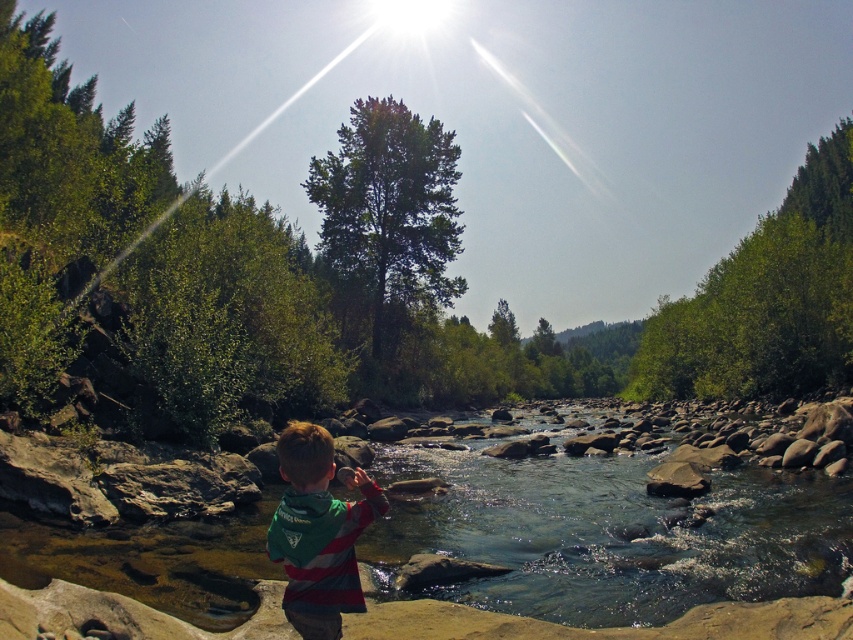
You are a parent who wants to ensure the safety of your child. The striped jersey boy at center is standing on the riverbank. Can you confirm if the clear water at center is within a safe distance for the child to play near?

The clear water at center is 8.35 meters away from the striped jersey boy at center. Since the distance is more than 5 meters, it is considered safe for the child to play near the water as they are not too close to the edge.

You are a photographer planning to take a photo of the striped jersey boy at center and the clear water at center. Based on their positions, which object is closer to the camera?

The clear water at center is taller than the striped jersey boy at center, so the striped jersey boy at center is closer to the camera.

You are the striped jersey boy at center in the image. You want to walk to the clear water at center. Which direction should you move?

The clear water at center is to the right of the striped jersey boy at center, so you should move to your right to reach the clear water at center.